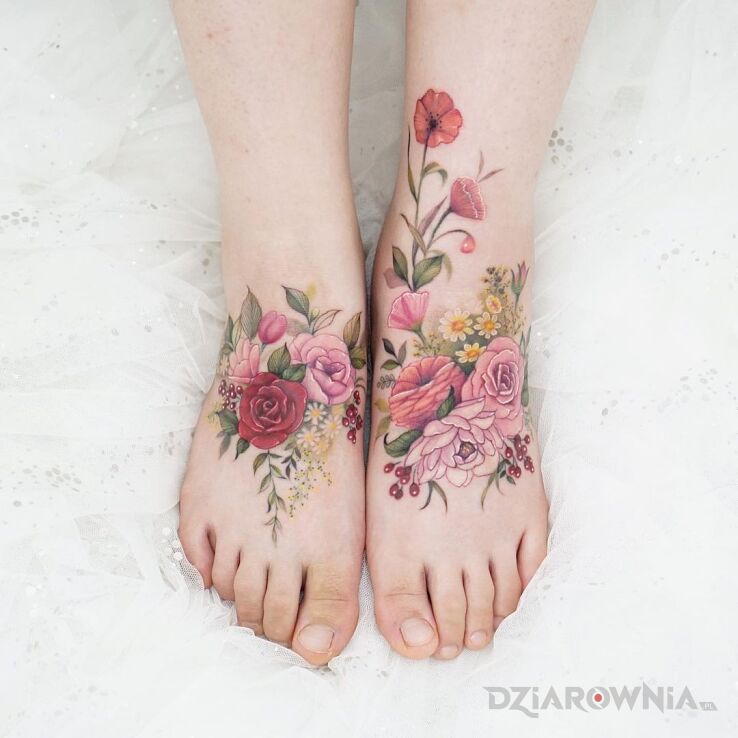
Where is `white cloth`? The height and width of the screenshot is (738, 738). white cloth is located at coordinates (644, 213), (370, 127), (68, 255), (275, 711).